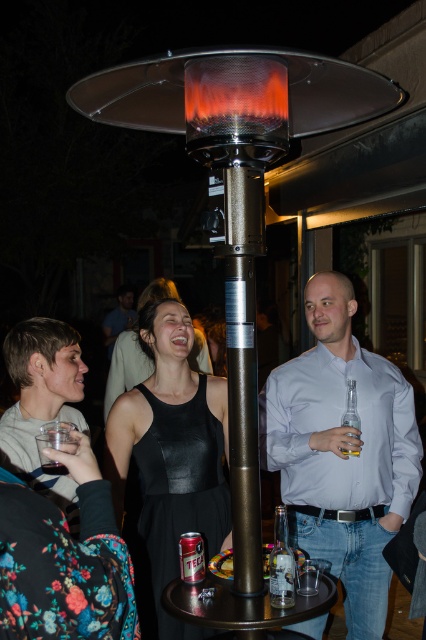
Question: In this image, where is floral fabric dress at lower left located relative to metallic silver pole at center?

Choices:
 (A) above
 (B) below

Answer: (B)

Question: Among these points, which one is nearest to the camera?

Choices:
 (A) (83, 438)
 (B) (282, 544)
 (C) (342, 509)
 (D) (63, 428)

Answer: (A)

Question: Does light blue shirt at center appear on the left side of metallic silver pole at center?

Choices:
 (A) yes
 (B) no

Answer: (B)

Question: Which of the following is the farthest from the observer?

Choices:
 (A) light blue shirt at center
 (B) clear plastic cup at lower left

Answer: (A)

Question: Among these points, which one is nearest to the camera?

Choices:
 (A) (83, 582)
 (B) (117, 330)
 (C) (232, 534)
 (D) (66, 433)

Answer: (A)

Question: Is black leather dress at center to the left of clear glass bottle at lower center from the viewer's perspective?

Choices:
 (A) yes
 (B) no

Answer: (A)